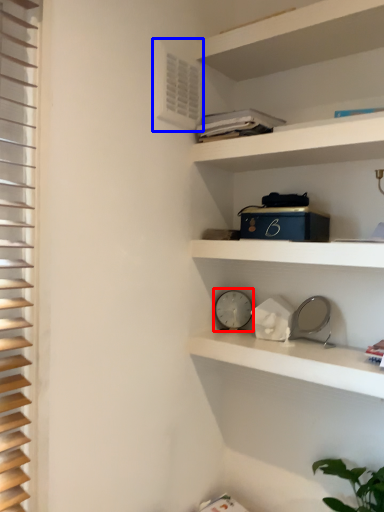
Question: Which point is further to the camera, clock (highlighted by a red box) or air conditioning (highlighted by a blue box)?

Choices:
 (A) clock
 (B) air conditioning

Answer: (A)